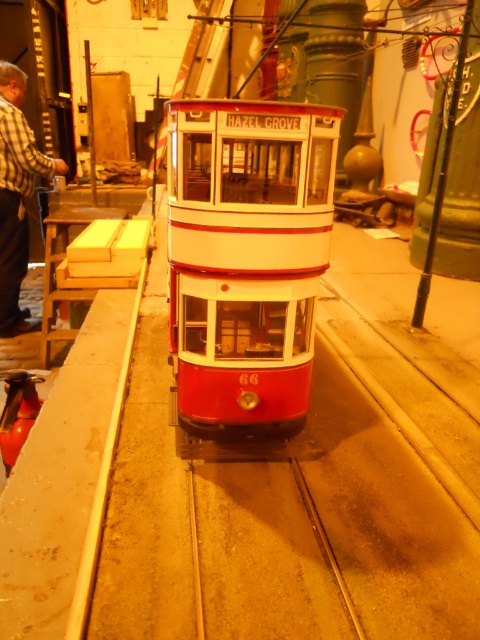
Who is lower down, metallic/smooth train track at center or plaid shirt at left?

Positioned lower is metallic/smooth train track at center.

Who is more distant from viewer, (296, 506) or (7, 250)?

The point (7, 250) is behind.

Image resolution: width=480 pixels, height=640 pixels. What do you see at coordinates (264, 556) in the screenshot? I see `metallic/smooth train track at center` at bounding box center [264, 556].

In order to click on metallic/smooth train track at center in this screenshot , I will do `click(264, 556)`.

Between point (312, 122) and point (19, 243), which one is positioned behind?

Positioned behind is point (19, 243).

Is point (180, 372) positioned after point (3, 128)?

No.

Describe the element at coordinates (247, 253) in the screenshot. I see `red matte double-decker bus at center` at that location.

Image resolution: width=480 pixels, height=640 pixels. I want to click on red matte double-decker bus at center, so click(x=247, y=253).

Can you confirm if red matte double-decker bus at center is shorter than metallic/smooth train track at center?

Incorrect, red matte double-decker bus at center's height does not fall short of metallic/smooth train track at center's.

Is point (267, 416) positioned before point (335, 627)?

No, it is behind (335, 627).

Does point (168, 316) come closer to viewer compared to point (225, 630)?

No, (168, 316) is further to viewer.

Where is `red matte double-decker bus at center`? red matte double-decker bus at center is located at coordinates (247, 253).